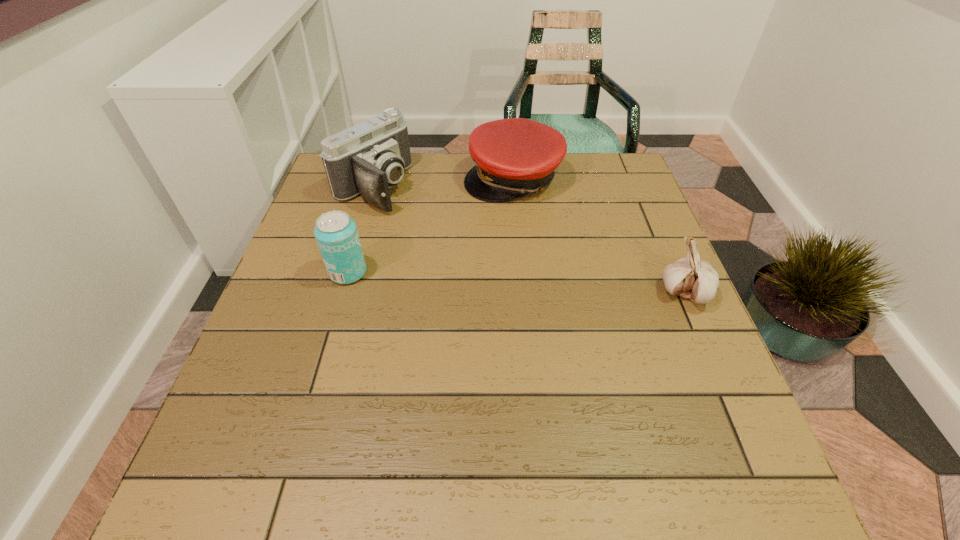
This screenshot has height=540, width=960. I want to click on vacant space at the left edge, so click(x=292, y=295).

Where is `vacant space at the right edge of the desktop`? Image resolution: width=960 pixels, height=540 pixels. vacant space at the right edge of the desktop is located at coordinates (644, 251).

In order to click on vacant space at the far left corner in this screenshot , I will do `click(324, 186)`.

Find the location of a particular element. free space at the far right corner of the desktop is located at coordinates (608, 186).

At what (x,y) coordinates should I click in order to perform the action: click on unoccupied position between the beer can and the camera. Please return your answer as a coordinate pair (x, y). The width and height of the screenshot is (960, 540). Looking at the image, I should click on (360, 230).

Locate an element on the screen. The height and width of the screenshot is (540, 960). vacant region between the rightmost object and the camera is located at coordinates (529, 240).

You are a GUI agent. You are given a task and a screenshot of the screen. Output one action in this format:
    pyautogui.click(x=<x>, y=<y>)
    Task: Click on the empty space between the camera and the cap
    The width and height of the screenshot is (960, 540).
    Given the screenshot: What is the action you would take?
    pyautogui.click(x=443, y=183)

You are a GUI agent. You are given a task and a screenshot of the screen. Output one action in this format:
    pyautogui.click(x=<x>, y=<y>)
    Task: Click on the vacant space in between the beer can and the rightmost object
    The height and width of the screenshot is (540, 960).
    Given the screenshot: What is the action you would take?
    pyautogui.click(x=516, y=283)

Where is `free space between the camera and the cap`? free space between the camera and the cap is located at coordinates (443, 183).

Image resolution: width=960 pixels, height=540 pixels. I want to click on free space between the cap and the camera, so click(443, 183).